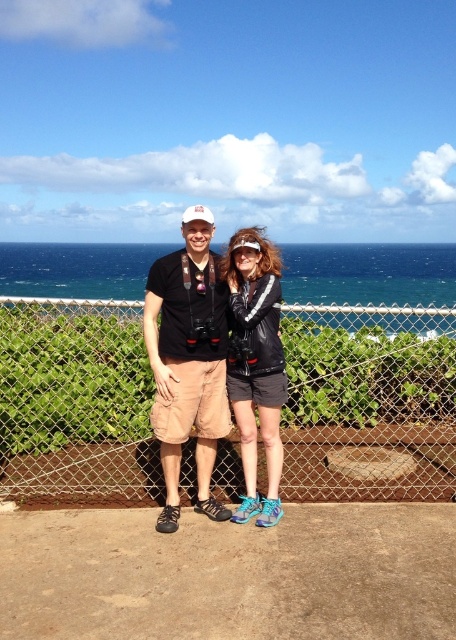
You are a photographer trying to capture a clear shot of the black matte shorts at center and the matte black jacket at center. Since the subjects are standing close to each other, will you need to adjust your focus to ensure both are in focus?

The black matte shorts at center is in front of the matte black jacket at center, so you will need to adjust your focus to ensure both are in focus.

You are a photographer trying to capture a clear shot of the metal mesh fence at center. You notice that the point at coordinate point (368, 403) is part of the fence. Where exactly on the fence would this point be located?

The point at coordinate (368, 403) corresponds to the metal mesh fence at center, so this point is located on the central part of the fence.